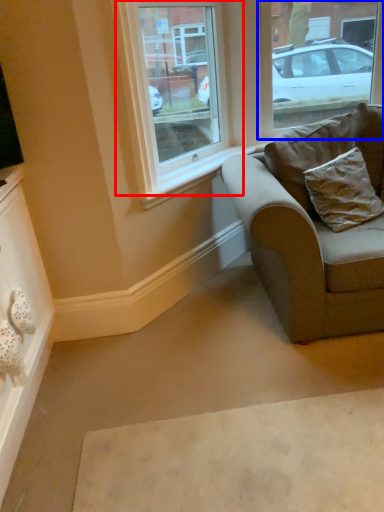
Question: Which point is closer to the camera, window (highlighted by a red box) or window (highlighted by a blue box)?

Choices:
 (A) window
 (B) window

Answer: (A)